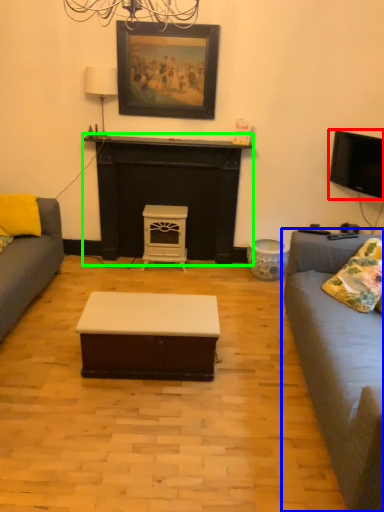
Question: Which object is the farthest from television (highlighted by a red box)? Choose among these: studio couch (highlighted by a blue box) or fireplace (highlighted by a green box).

Choices:
 (A) studio couch
 (B) fireplace

Answer: (B)